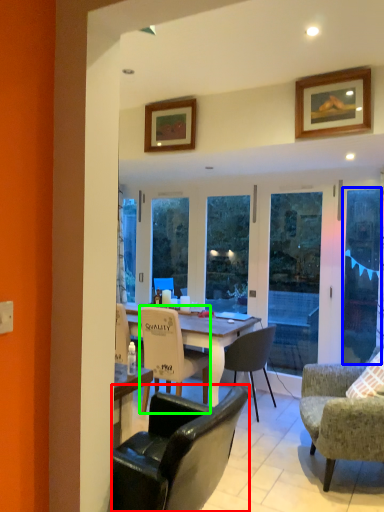
Question: Which object is the closest to the chair (highlighted by a red box)? Choose among these: screen door (highlighted by a blue box) or chair (highlighted by a green box).

Choices:
 (A) screen door
 (B) chair

Answer: (B)